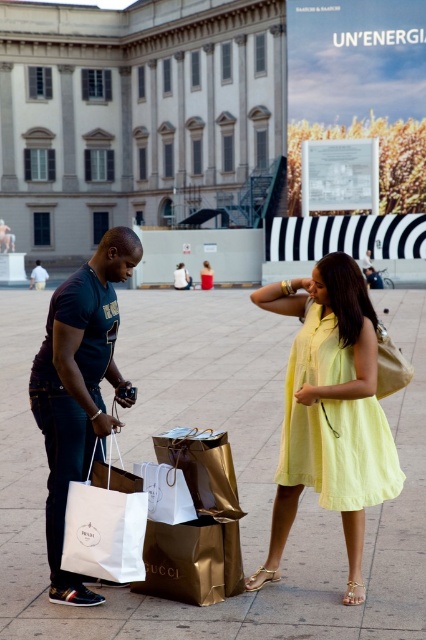
Does dark blue t-shirt at left appear over gold metallic shopping bag at center?

Indeed, dark blue t-shirt at left is positioned over gold metallic shopping bag at center.

Is dark blue t-shirt at left shorter than gold metallic shopping bag at center?

In fact, dark blue t-shirt at left may be taller than gold metallic shopping bag at center.

Is point (80, 388) more distant than point (189, 461)?

That is False.

This screenshot has width=426, height=640. I want to click on dark blue t-shirt at left, so click(78, 387).

Does matte black t-shirt at left appear on the left side of yellow cotton dress at center?

Yes, matte black t-shirt at left is to the left of yellow cotton dress at center.

Locate an element on the screen. Image resolution: width=426 pixels, height=640 pixels. matte black t-shirt at left is located at coordinates (39, 276).

I want to click on matte black t-shirt at left, so click(39, 276).

Which is behind, point (264, 353) or point (175, 504)?

The point (264, 353) is more distant.

Is point (423, 502) positioned before point (164, 522)?

No, it is behind (164, 522).

You are a GUI agent. You are given a task and a screenshot of the screen. Output one action in this format:
    pyautogui.click(x=<x>, y=<y>)
    Task: Click on the white smooth pavement at center
    This screenshot has width=426, height=640.
    Given the screenshot: What is the action you would take?
    pyautogui.click(x=285, y=547)